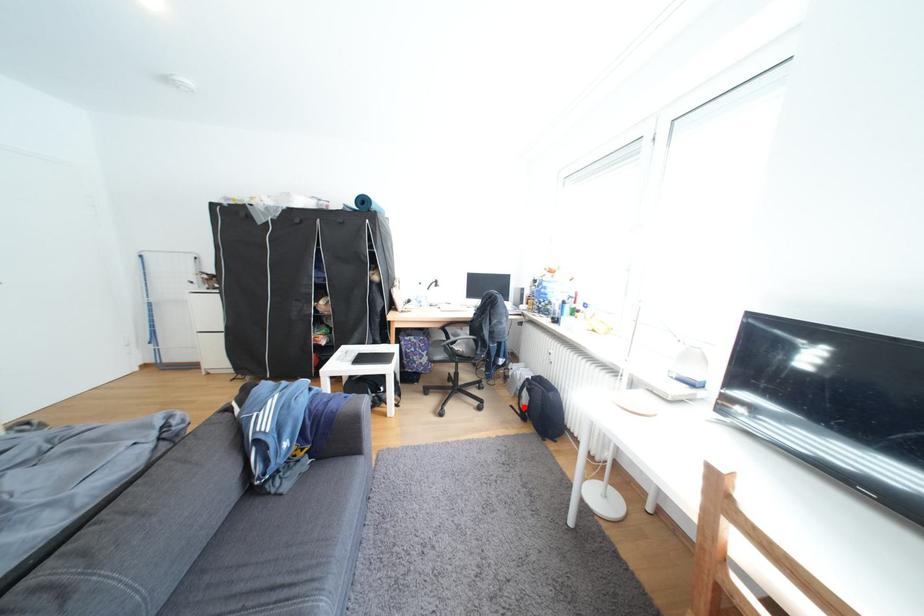
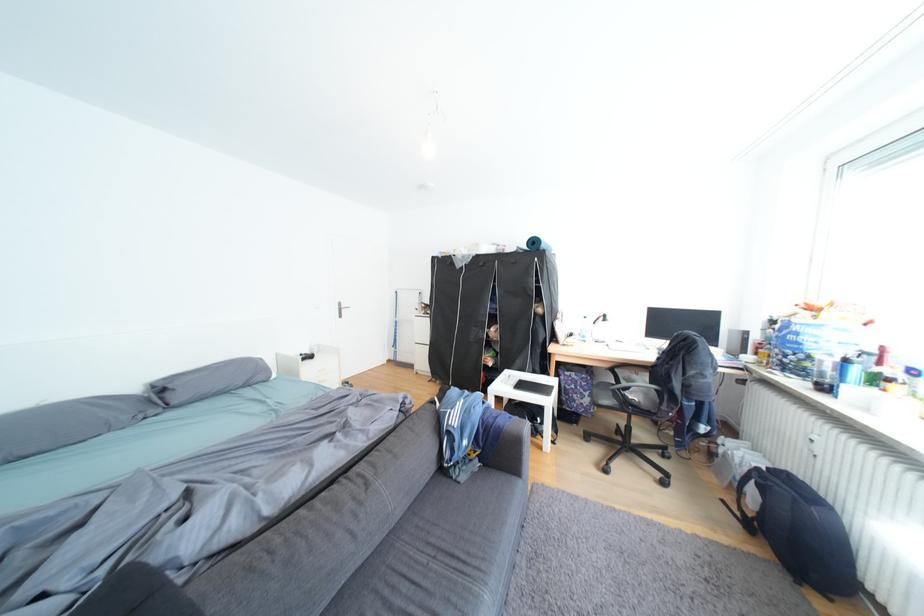
Where in the second image is the point corresponding to the highlighted location from the first image?

(736, 501)